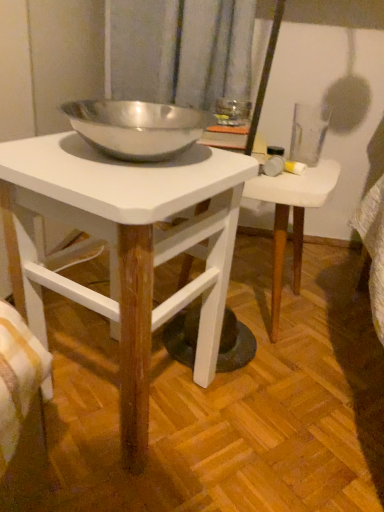
Locate an element on the screen. empty space that is ontop of white matte table at center, which is the first table from front to back (from a real-world perspective) is located at coordinates (122, 161).